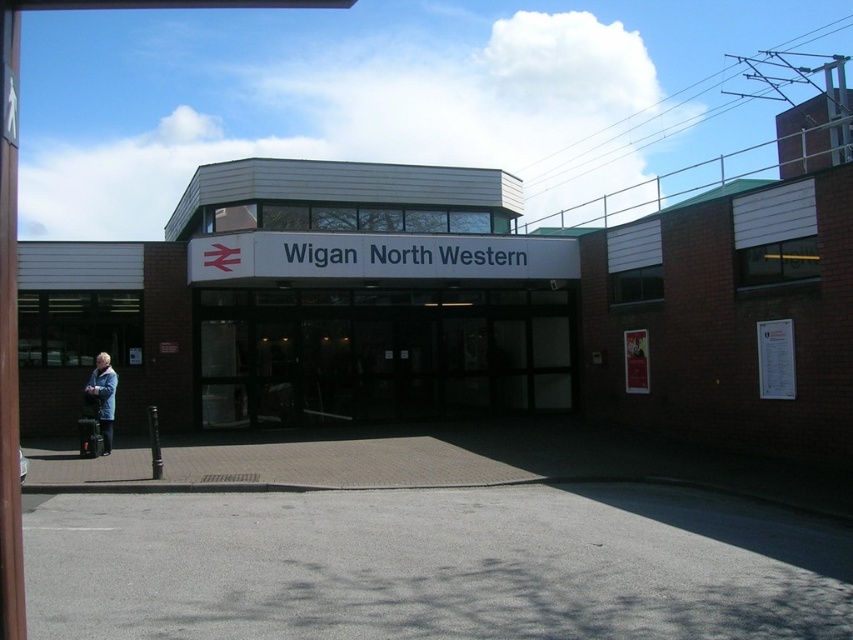
Is transparent glass doors at center wider than blue denim jacket at left?

Indeed, transparent glass doors at center has a greater width compared to blue denim jacket at left.

The width and height of the screenshot is (853, 640). Describe the element at coordinates (380, 353) in the screenshot. I see `transparent glass doors at center` at that location.

This screenshot has height=640, width=853. Find the location of `transparent glass doors at center`. transparent glass doors at center is located at coordinates (380, 353).

This screenshot has height=640, width=853. In order to click on transparent glass doors at center in this screenshot , I will do `click(380, 353)`.